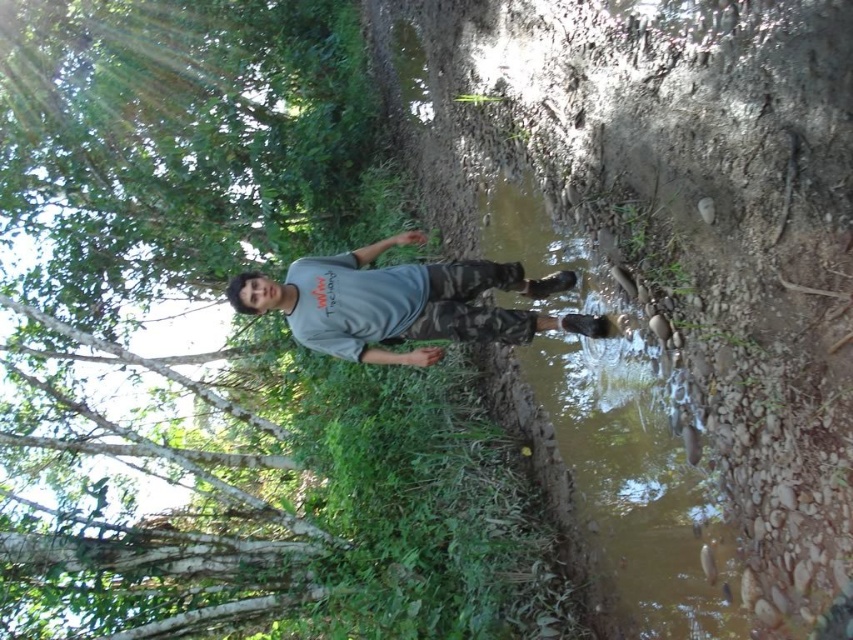
You are a photographer trying to capture the scene with a wide angle lens. You want to ensure that both the brown muddy stream at center and the gray matte shirt at center are in focus. Given that your lens can only focus on one plane, which object should you prioritize focusing on to ensure the other is also in focus?

You should prioritize focusing on the brown muddy stream at center because it is closer to the viewer than the gray matte shirt at center. By focusing on the closer object, the depth of field may extend to include the farther object in acceptable focus.

You are a hiker who wants to cross the stream safely. The point marked at coordinates (682, 220) is part of the brown muddy stream at center. Which part of the stream should you avoid stepping on to prevent slipping?

The brown muddy stream at center is the part you should avoid stepping on to prevent slipping because the mud can be slippery and unstable underfoot.

You are planning to cross the brown muddy stream at center and need to know if the green leafy tree at upper left can provide shade over the stream. Based on their sizes, is the tree large enough to cover the stream?

The brown muddy stream at center is larger in size than the green leafy tree at upper left, so the tree is not large enough to provide full shade over the stream.